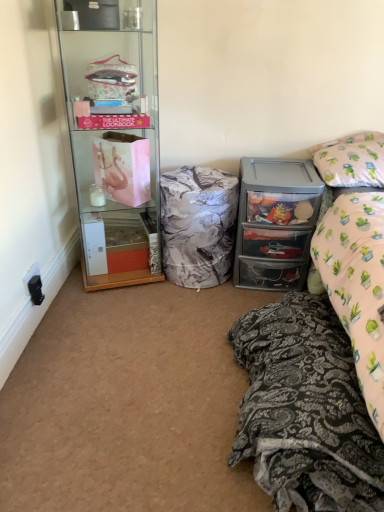
You are a GUI agent. You are given a task and a screenshot of the screen. Output one action in this format:
    pyautogui.click(x=<x>, y=<y>)
    Task: Click on the vacant space in between marble-patterned fabric at center and patterned fabric bed at lower right
    The image size is (384, 512).
    Given the screenshot: What is the action you would take?
    pyautogui.click(x=205, y=336)